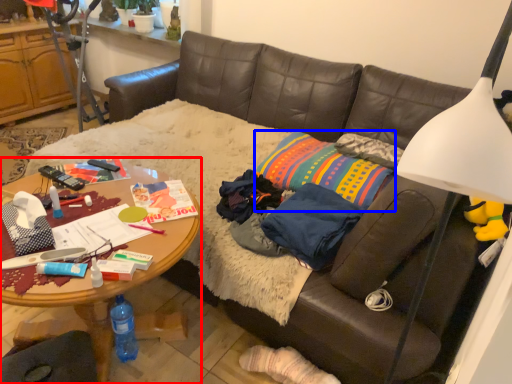
Question: Which point is further to the camera, desk (highlighted by a red box) or pillow (highlighted by a blue box)?

Choices:
 (A) desk
 (B) pillow

Answer: (B)